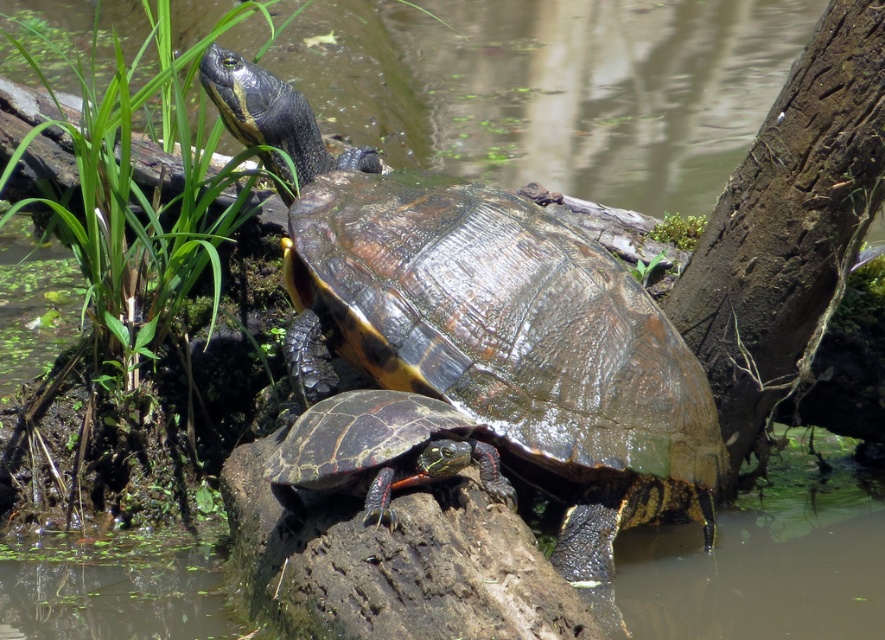
You are a photographer trying to capture both the shiny brown tortoise at center and the shiny dark green tortoise at center in a single frame. Based on their positions, which tortoise should you adjust your camera to focus on first to ensure both are in the shot?

The shiny dark green tortoise at center should be focused on first since the shiny brown tortoise at center is to its right, meaning adjusting focus on the leftmost turtle ensures both are captured in the frame.

You are a wildlife researcher observing the scene. You need to locate the shiny brown tortoise at center. What are its coordinates in the image?

The shiny brown tortoise at center is located at coordinates point (486, 324).